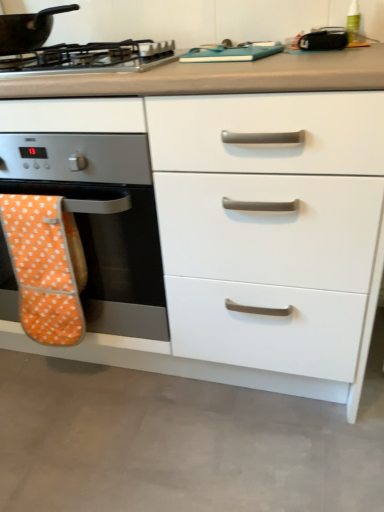
Question: Can you confirm if orange polka dot oven mitt at left is taller than metallic silver gas stove at upper left?

Choices:
 (A) yes
 (B) no

Answer: (A)

Question: From a real-world perspective, is orange polka dot oven mitt at left over metallic silver gas stove at upper left?

Choices:
 (A) no
 (B) yes

Answer: (A)

Question: Can you confirm if orange polka dot oven mitt at left is bigger than metallic silver gas stove at upper left?

Choices:
 (A) no
 (B) yes

Answer: (A)

Question: Is orange polka dot oven mitt at left shorter than metallic silver gas stove at upper left?

Choices:
 (A) no
 (B) yes

Answer: (A)

Question: Does orange polka dot oven mitt at left have a greater width compared to metallic silver gas stove at upper left?

Choices:
 (A) no
 (B) yes

Answer: (A)

Question: Is orange polka dot oven mitt at left facing towards metallic silver gas stove at upper left?

Choices:
 (A) no
 (B) yes

Answer: (A)

Question: Is black matte pan at upper left surrounded by white glossy drawer at center?

Choices:
 (A) no
 (B) yes

Answer: (A)

Question: Is white glossy drawer at center far away from black matte pan at upper left?

Choices:
 (A) yes
 (B) no

Answer: (B)

Question: From the image's perspective, does white glossy drawer at center appear lower than black matte pan at upper left?

Choices:
 (A) yes
 (B) no

Answer: (A)

Question: Is white glossy drawer at center oriented away from black matte pan at upper left?

Choices:
 (A) no
 (B) yes

Answer: (A)

Question: Is white glossy drawer at center wider than black matte pan at upper left?

Choices:
 (A) yes
 (B) no

Answer: (A)

Question: Can you confirm if white glossy drawer at center is taller than black matte pan at upper left?

Choices:
 (A) no
 (B) yes

Answer: (B)

Question: Is orange fabric oven mitt at left taller than black matte pan at upper left?

Choices:
 (A) no
 (B) yes

Answer: (B)